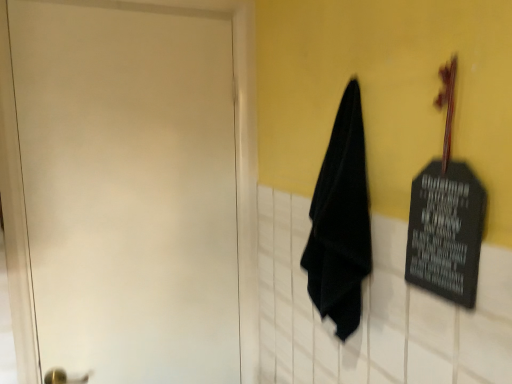
Question: Is point (29, 100) closer or farther from the camera than point (339, 132)?

Choices:
 (A) farther
 (B) closer

Answer: (A)

Question: Is white matte door at left inside the boundaries of black matte towel at center, or outside?

Choices:
 (A) outside
 (B) inside

Answer: (A)

Question: Considering the positions of white matte door at left and black matte towel at center in the image, is white matte door at left wider or thinner than black matte towel at center?

Choices:
 (A) wide
 (B) thin

Answer: (B)

Question: Is black matte towel at center to the left or to the right of white matte door at left in the image?

Choices:
 (A) left
 (B) right

Answer: (B)

Question: Is black matte towel at center inside or outside of white matte door at left?

Choices:
 (A) outside
 (B) inside

Answer: (A)

Question: In terms of width, does black matte towel at center look wider or thinner when compared to white matte door at left?

Choices:
 (A) thin
 (B) wide

Answer: (B)

Question: Looking at the image, does black matte towel at center seem bigger or smaller compared to white matte door at left?

Choices:
 (A) big
 (B) small

Answer: (B)